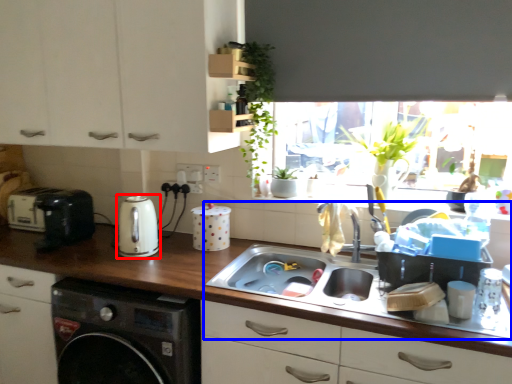
Question: Which object is closer to the camera taking this photo, kitchen appliance (highlighted by a red box) or sink (highlighted by a blue box)?

Choices:
 (A) kitchen appliance
 (B) sink

Answer: (B)